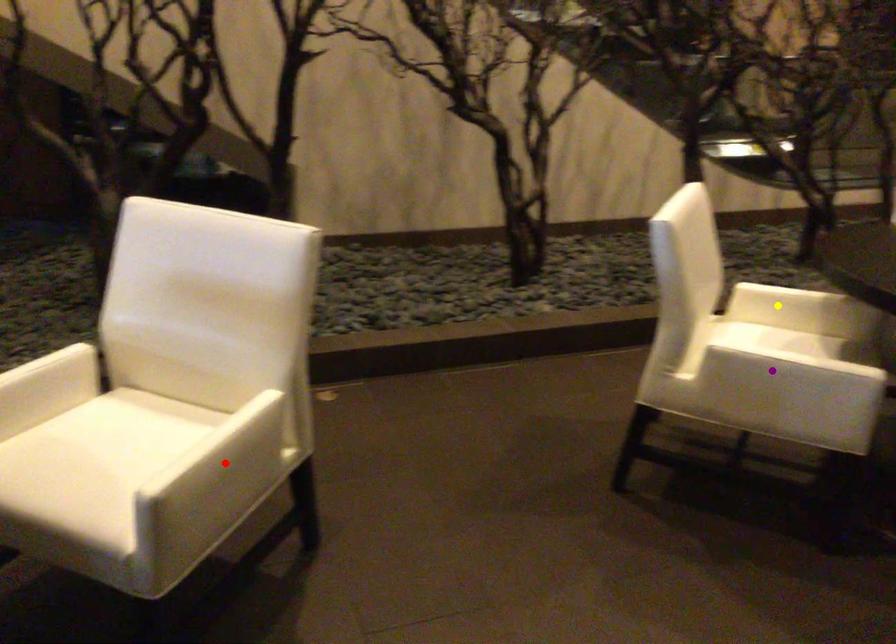
Order these from farthest to nearest:
1. yellow point
2. purple point
3. red point

yellow point, purple point, red point